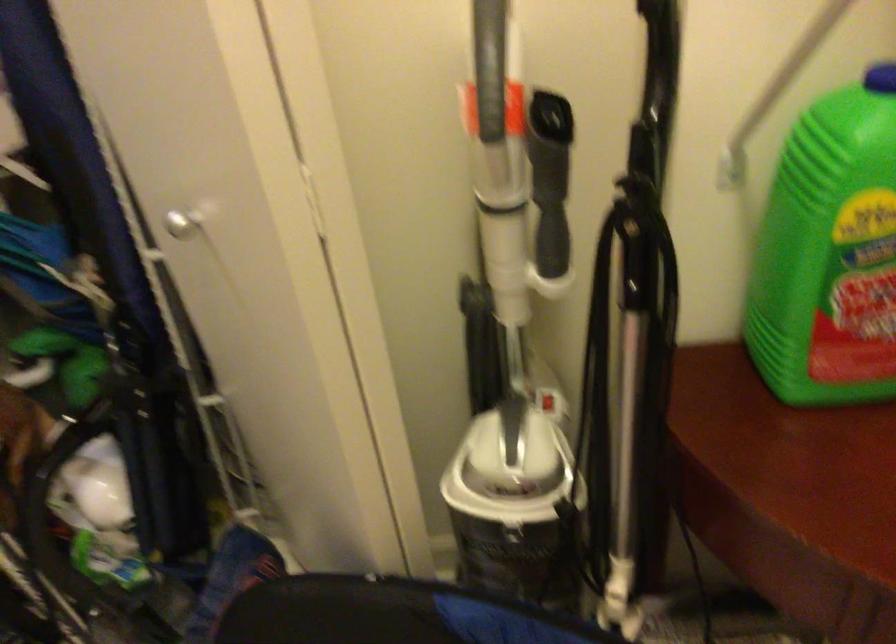
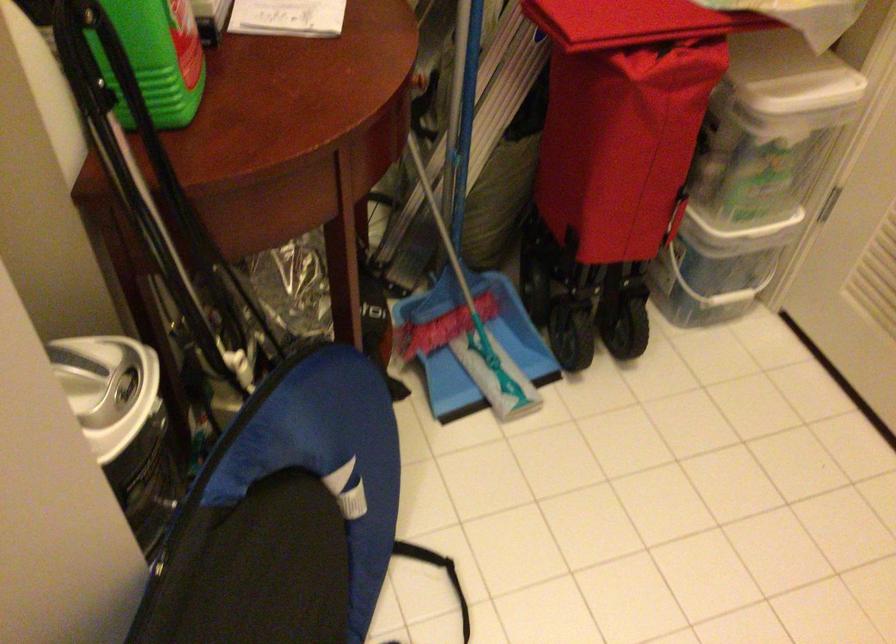
Locate, in the second image, the point that corresponds to [497,474] in the first image.

(107, 388)